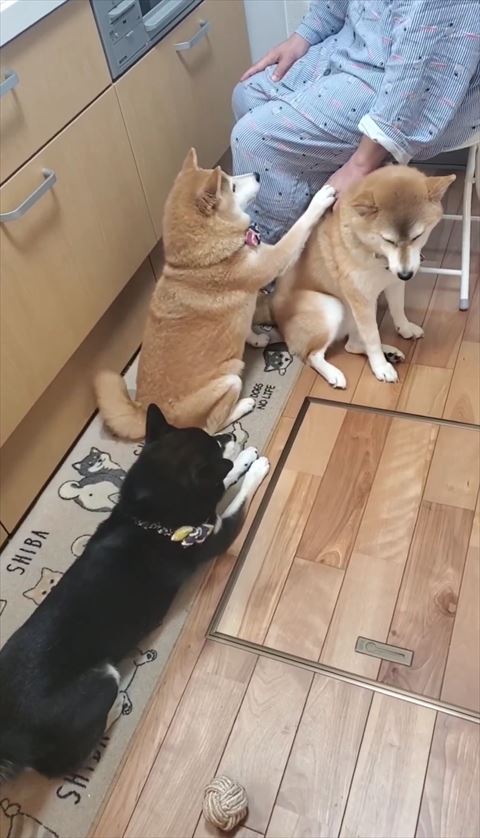
What are the coordinates of `chair leg` in the screenshot? It's located at (463, 246), (477, 185).